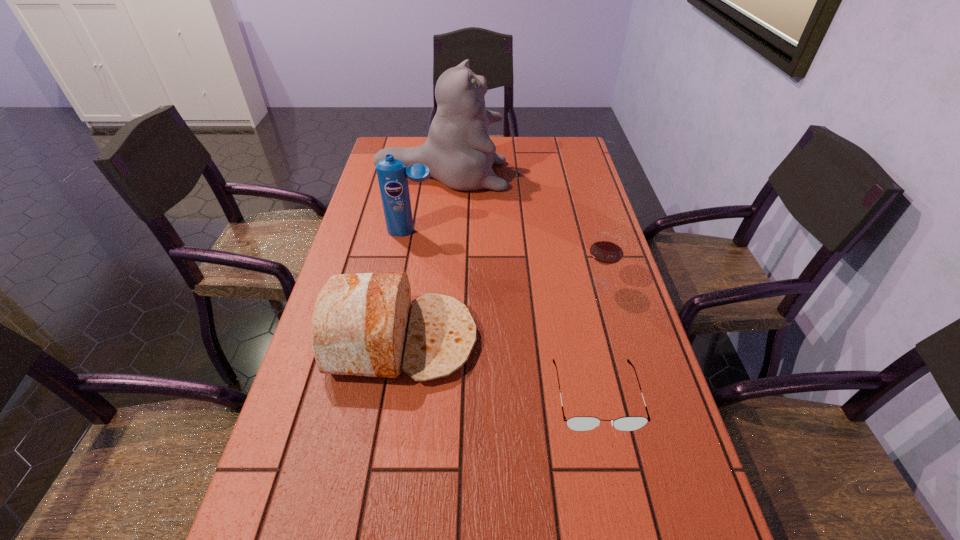
I want to click on the farthest object, so click(x=459, y=153).

The height and width of the screenshot is (540, 960). I want to click on the tallest object, so click(459, 153).

At what (x,y) coordinates should I click in order to perform the action: click on shampoo. Please return your answer as a coordinate pair (x, y). The height and width of the screenshot is (540, 960). Looking at the image, I should click on (392, 174).

Identify the location of the fourth nearest object. The height and width of the screenshot is (540, 960). (392, 174).

This screenshot has width=960, height=540. Identify the location of bread. (364, 324).

Identify the location of the third nearest object. (607, 248).

What are the coordinates of `the shortest object` in the screenshot? It's located at (579, 423).

The image size is (960, 540). Identify the location of blank area located on the face of the cat. (540, 176).

I want to click on free space located on the right of the fourth shortest object, so click(x=465, y=232).

Locate an element on the screen. The width and height of the screenshot is (960, 540). blank space located 0.310m at the sliced end of the bread is located at coordinates (609, 340).